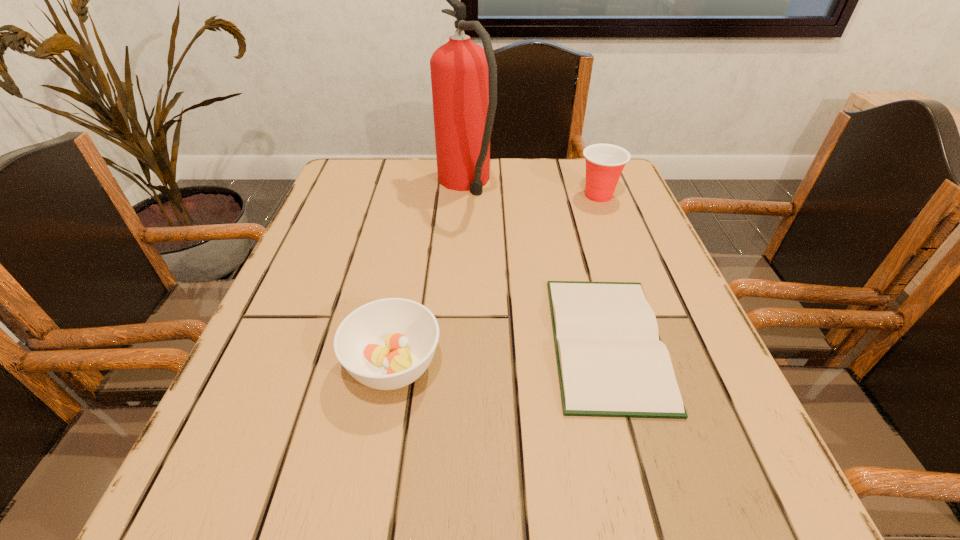
Where is `object that can be found as the second closest to the hardback book`? object that can be found as the second closest to the hardback book is located at coordinates (463, 75).

The width and height of the screenshot is (960, 540). I want to click on free location that satisfies the following two spatial constraints: 1. on the back side of the cup; 2. on the left side of the hardback book, so click(x=566, y=195).